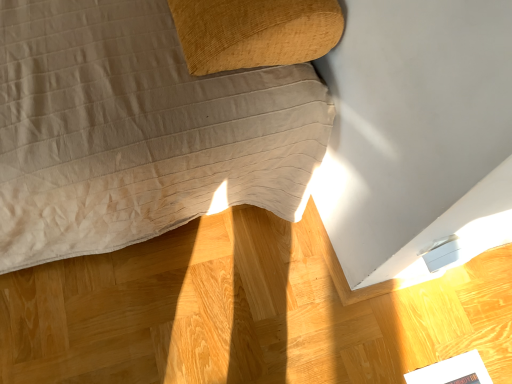
Question: Can you confirm if white glossy magazine at lower right is smaller than wooden table at center?

Choices:
 (A) no
 (B) yes

Answer: (B)

Question: Considering the relative positions of white glossy magazine at lower right and wooden table at center in the image provided, is white glossy magazine at lower right to the right of wooden table at center from the viewer's perspective?

Choices:
 (A) no
 (B) yes

Answer: (B)

Question: From a real-world perspective, is white glossy magazine at lower right located beneath wooden table at center?

Choices:
 (A) yes
 (B) no

Answer: (A)

Question: Is white glossy magazine at lower right to the left of wooden table at center from the viewer's perspective?

Choices:
 (A) yes
 (B) no

Answer: (B)

Question: Would you say white glossy magazine at lower right is a long distance from wooden table at center?

Choices:
 (A) yes
 (B) no

Answer: (B)

Question: Is white glossy magazine at lower right thinner than wooden table at center?

Choices:
 (A) yes
 (B) no

Answer: (A)

Question: Would you say wooden table at center is outside white glossy magazine at lower right?

Choices:
 (A) no
 (B) yes

Answer: (B)

Question: Considering the relative positions of wooden table at center and white glossy magazine at lower right in the image provided, is wooden table at center to the right of white glossy magazine at lower right from the viewer's perspective?

Choices:
 (A) yes
 (B) no

Answer: (B)

Question: Is wooden table at center looking in the opposite direction of white glossy magazine at lower right?

Choices:
 (A) no
 (B) yes

Answer: (A)

Question: From a real-world perspective, is wooden table at center below white glossy magazine at lower right?

Choices:
 (A) yes
 (B) no

Answer: (B)

Question: From the image's perspective, is wooden table at center on white glossy magazine at lower right?

Choices:
 (A) yes
 (B) no

Answer: (A)

Question: Does wooden table at center have a larger size compared to white glossy magazine at lower right?

Choices:
 (A) no
 (B) yes

Answer: (B)

Question: Is wooden table at center in front of or behind white glossy magazine at lower right in the image?

Choices:
 (A) front
 (B) behind

Answer: (A)